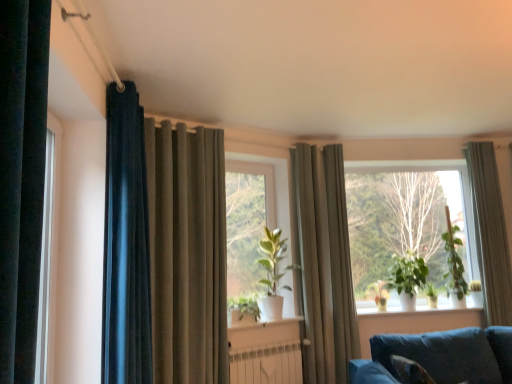
Describe the element at coordinates (268, 187) in the screenshot. I see `green matte plant at center, which ranks as the 2th window in back-to-front order` at that location.

What do you see at coordinates (448, 355) in the screenshot? I see `velvet blue couch at lower right` at bounding box center [448, 355].

What do you see at coordinates (273, 272) in the screenshot? This screenshot has height=384, width=512. I see `green matte plant at center` at bounding box center [273, 272].

Where is `white matte radiator at lower center`? This screenshot has height=384, width=512. white matte radiator at lower center is located at coordinates click(267, 364).

Identify the location of matte gray curtain at center, the second curtain positioned from the right. (323, 263).

Describe the element at coordinates (379, 293) in the screenshot. This screenshot has width=512, height=384. I see `green matte plant at center, which is counted as the fourth plant, starting from the right` at that location.

Locate an element on the screen. The height and width of the screenshot is (384, 512). green matte plant at center, which ranks as the 2th window in back-to-front order is located at coordinates (268, 187).

Is green matte plant at center, the 2th window from the front, placed right next to light gray textured curtain at right, which is the 4th curtain in left-to-right order?

No, green matte plant at center, the 2th window from the front, is not making contact with light gray textured curtain at right, which is the 4th curtain in left-to-right order.

Considering the sizes of green matte plant at center, the 1th window from the back, and light gray textured curtain at right, which is the 4th curtain in left-to-right order, in the image, is green matte plant at center, the 1th window from the back, bigger or smaller than light gray textured curtain at right, which is the 4th curtain in left-to-right order,?

green matte plant at center, the 1th window from the back, is bigger than light gray textured curtain at right, which is the 4th curtain in left-to-right order.

Between green matte plant at center, which is counted as the first window, starting from the right, and light gray textured curtain at right, which is the 4th curtain in left-to-right order, which one has more height?

light gray textured curtain at right, which is the 4th curtain in left-to-right order, is taller.

Which object is positioned more to the left, white matte window sill at center or white plastic window frame at left?

From the viewer's perspective, white plastic window frame at left appears more on the left side.

Could you tell me if white matte window sill at center is facing white plastic window frame at left?

No, white matte window sill at center is not aimed at white plastic window frame at left.

This screenshot has height=384, width=512. In order to click on window sill on the right of white plastic window frame at left in this screenshot , I will do `click(258, 321)`.

Is white matte window sill at center in front of white plastic window frame at left?

No.

Is matte gray curtain at center, the second curtain positioned from the right, turned away from green matte plant at center, the fifth plant positioned from the right?

No, matte gray curtain at center, the second curtain positioned from the right, is not facing away from green matte plant at center, the fifth plant positioned from the right.

Is green matte plant at center, the fifth plant positioned from the right, completely or partially inside matte gray curtain at center, the third curtain from the left?

No.

Who is shorter, matte gray curtain at center, the second curtain positioned from the right, or green matte plant at center, the fifth plant positioned from the right?

green matte plant at center, the fifth plant positioned from the right, is shorter.

Based on the photo, which object is positioned more to the left, matte gray curtain at center, the third curtain from the left, or green matte plant at center, the fifth plant positioned from the right?

Positioned to the left is green matte plant at center, the fifth plant positioned from the right.

From the image's perspective, is green matte plant at right, the first plant positioned from the right, above white matte window sill at center?

Yes.

Does point (461, 260) come in front of point (270, 321)?

No, (461, 260) is further to viewer.

Considering the relative sizes of green matte plant at right, the first plant positioned from the right, and white matte window sill at center in the image provided, is green matte plant at right, the first plant positioned from the right, taller than white matte window sill at center?

Yes.

Which is further, (42, 375) or (492, 306)?

Positioned behind is point (492, 306).

Considering the relative sizes of white plastic window frame at left and light gray textured curtain at right, which is the 4th curtain in left-to-right order, in the image provided, is white plastic window frame at left bigger than light gray textured curtain at right, which is the 4th curtain in left-to-right order,?

No, white plastic window frame at left is not bigger than light gray textured curtain at right, which is the 4th curtain in left-to-right order.

Is light gray textured curtain at right, the first curtain viewed from the right, completely or partially inside white plastic window frame at left?

Definitely not — light gray textured curtain at right, the first curtain viewed from the right, is not inside white plastic window frame at left.

Between white plastic window frame at left and light gray textured curtain at right, the first curtain viewed from the right, which one appears on the right side from the viewer's perspective?

light gray textured curtain at right, the first curtain viewed from the right, is more to the right.

Does matte blue curtain at left, which is counted as the first curtain, starting from the left, have a greater width compared to green matte plant at center, the 1th window from the back?

Yes.

Can you see matte blue curtain at left, which is counted as the first curtain, starting from the left, touching green matte plant at center, which is counted as the first window, starting from the right?

They are not placed beside each other.

Is matte blue curtain at left, which is counted as the fourth curtain, starting from the right, at the right side of green matte plant at center, which is counted as the first window, starting from the right?

No, matte blue curtain at left, which is counted as the fourth curtain, starting from the right, is not to the right of green matte plant at center, which is counted as the first window, starting from the right.

Between matte blue curtain at left, which is counted as the fourth curtain, starting from the right, and green matte plant at center, the 2th window from the front, which one has smaller size?

With smaller size is green matte plant at center, the 2th window from the front.

In the scene shown: From the image's perspective, which one is positioned lower, green matte plant at center, arranged as the first window when viewed from the front, or green matte plant at center, marked as the 2th window in a left-to-right arrangement?

green matte plant at center, marked as the 2th window in a left-to-right arrangement.

From their relative heights in the image, would you say green matte plant at center, the 2th window viewed from the right, is taller or shorter than green matte plant at center, the 1th window from the back?

Clearly, green matte plant at center, the 2th window viewed from the right, is shorter compared to green matte plant at center, the 1th window from the back.

Is green matte plant at center, which ranks as the 2th window in back-to-front order, far from green matte plant at center, marked as the 2th window in a left-to-right arrangement?

Yes, green matte plant at center, which ranks as the 2th window in back-to-front order, and green matte plant at center, marked as the 2th window in a left-to-right arrangement, are quite far apart.

From a real-world perspective, who is located higher, green matte plant at center, arranged as the first window when viewed from the front, or green matte plant at center, which is counted as the first window, starting from the right?

In real-world perspective, green matte plant at center, arranged as the first window when viewed from the front, is above.

Which curtain is the 1st one when counting from the front of the green matte plant at center, the 2th window from the front? Please provide its 2D coordinates.

[(490, 232)]

I want to click on window sill behind the white plastic window frame at left, so click(258, 321).

Looking at the image, which one is located closer to satin beige curtain at left, which is counted as the 3th curtain, starting from the right, matte blue curtain at left, which is counted as the first curtain, starting from the left, or green matte plant at center, the fifth plant positioned from the right?

matte blue curtain at left, which is counted as the first curtain, starting from the left, is positioned closer to the anchor satin beige curtain at left, which is counted as the 3th curtain, starting from the right.

Based on the photo, based on their spatial positions, is green matte plant at center or green matte plant at center, the first plant when ordered from left to right, closer to matte blue curtain at left, which is counted as the first curtain, starting from the left?

green matte plant at center, the first plant when ordered from left to right, is closer to matte blue curtain at left, which is counted as the first curtain, starting from the left.

When comparing their distances from green matte plant at center, the fifth plant positioned from the right, does velvet blue couch at lower right or light gray textured curtain at right, the first curtain viewed from the right, seem further?

Based on the image, light gray textured curtain at right, the first curtain viewed from the right, appears to be further to green matte plant at center, the fifth plant positioned from the right.

Which object lies further to the anchor point light gray textured curtain at right, the first curtain viewed from the right, green matte plant at center, the 1th window from the back, or matte gray curtain at center, the third curtain from the left?

matte gray curtain at center, the third curtain from the left, lies further to light gray textured curtain at right, the first curtain viewed from the right, than the other object.

Looking at this image, looking at the image, which one is located closer to green matte plant at center, the fifth plant positioned from the right, satin beige curtain at left, which is counted as the 3th curtain, starting from the right, or green matte plant at center, the second plant from the left?

satin beige curtain at left, which is counted as the 3th curtain, starting from the right, lies closer to green matte plant at center, the fifth plant positioned from the right, than the other object.

Based on their spatial positions, is green matte plant at center, the second plant from the left, or matte gray curtain at center, the third curtain from the left, further from white matte radiator at lower center?

green matte plant at center, the second plant from the left, is positioned further to the anchor white matte radiator at lower center.

From the image, which object appears to be nearer to green matte plant at center, white plastic window frame at left or matte blue curtain at left, which is counted as the first curtain, starting from the left?

matte blue curtain at left, which is counted as the first curtain, starting from the left, lies closer to green matte plant at center than the other object.

Estimate the real-world distances between objects in this image. Which object is closer to matte gray curtain at center, the third curtain from the left, satin beige curtain at left, marked as the 2th curtain in a left-to-right arrangement, or white matte radiator at lower center?

white matte radiator at lower center.

Find the location of `studio couch situated between green matte plant at center and green matte plant at right, acting as the 5th plant starting from the left, from left to right`. studio couch situated between green matte plant at center and green matte plant at right, acting as the 5th plant starting from the left, from left to right is located at coordinates (448, 355).

The height and width of the screenshot is (384, 512). I want to click on studio couch located between white matte window sill at center and green matte plant at center, the third plant positioned from the left, in the left-right direction, so click(x=448, y=355).

You are a GUI agent. You are given a task and a screenshot of the screen. Output one action in this format:
    pyautogui.click(x=<x>, y=<y>)
    Task: Click on the window sill between matte blue curtain at left, which is counted as the first curtain, starting from the left, and green matte plant at center, marked as the 2th window in a left-to-right arrangement
    This screenshot has width=512, height=384.
    Given the screenshot: What is the action you would take?
    pyautogui.click(x=258, y=321)

Locate an element on the screen. This screenshot has width=512, height=384. plant between green matte plant at center, arranged as the 3th plant when viewed from the right, and green matte plant at right, acting as the 5th plant starting from the left is located at coordinates (431, 294).